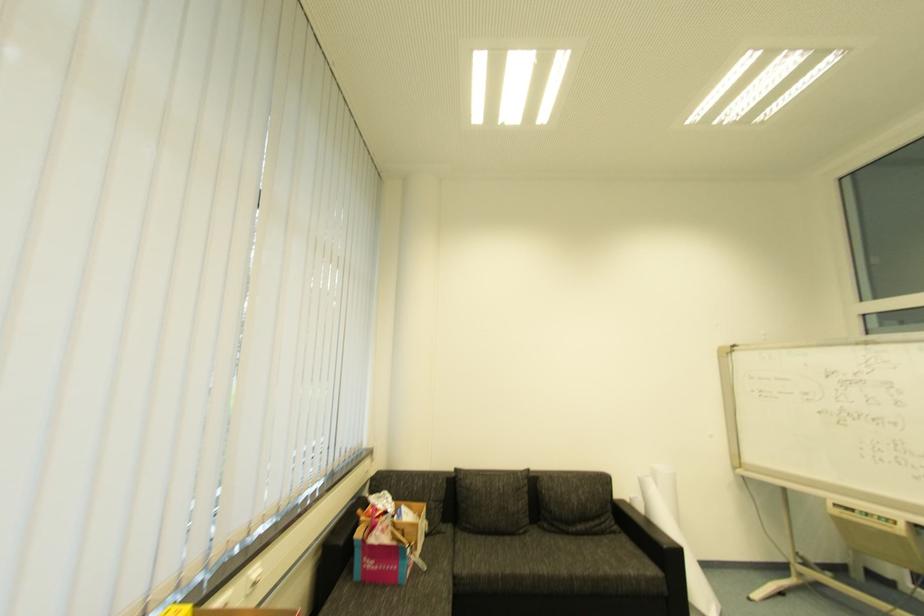
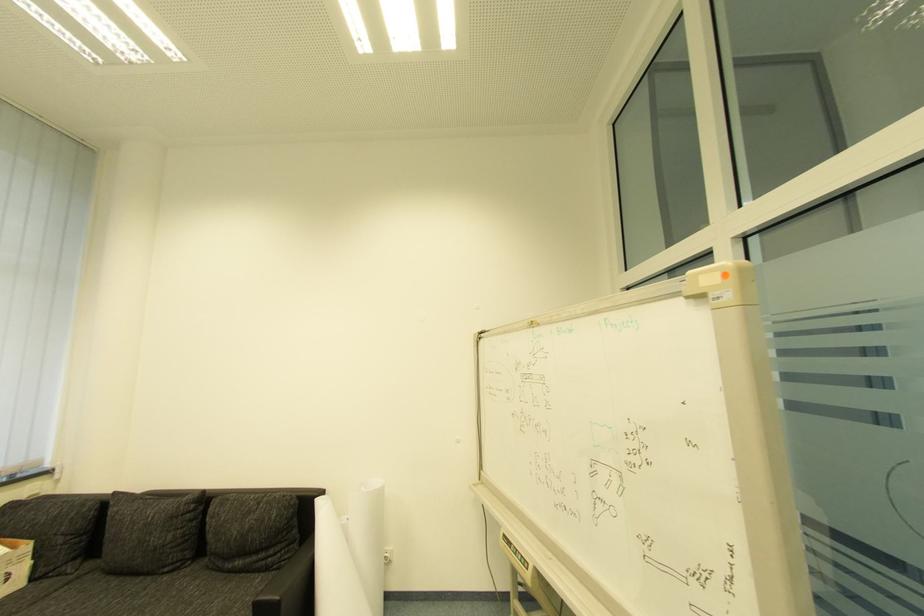
Question: What movement of the cameraman would produce the second image?

Choices:
 (A) Left
 (B) Right
 (C) Forward
 (D) Backward

Answer: (B)